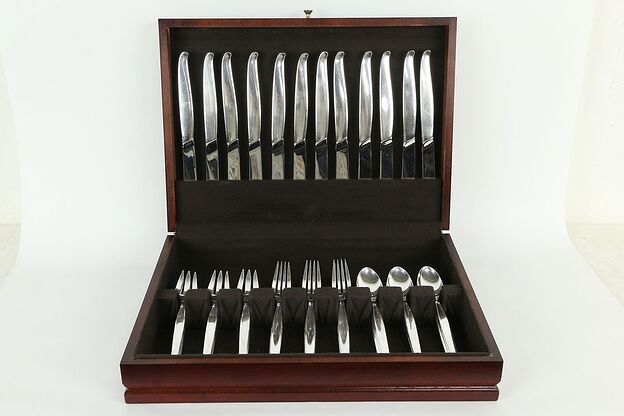
What are the coordinates of `forks` in the screenshot? It's located at (177, 332), (208, 329), (243, 330), (273, 330), (344, 325), (308, 332).